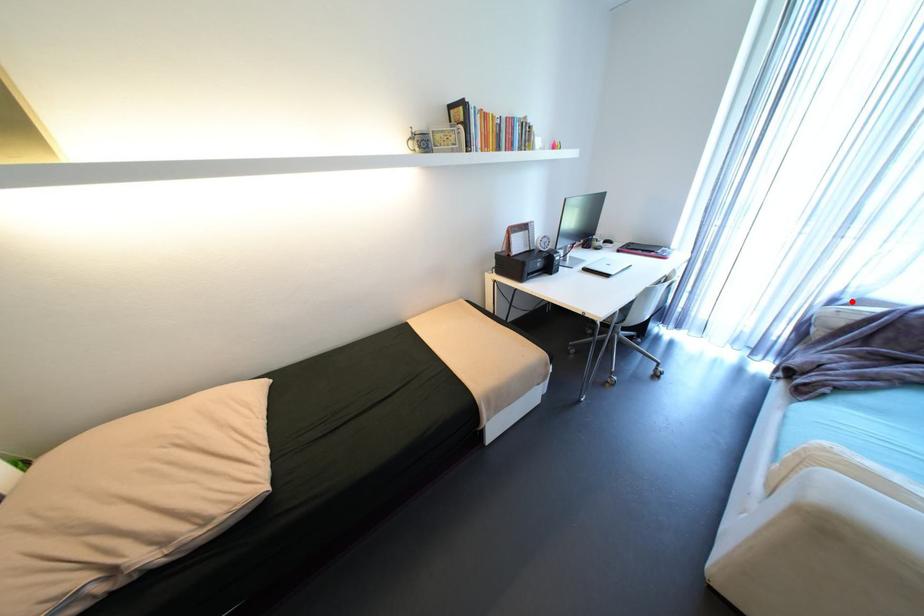
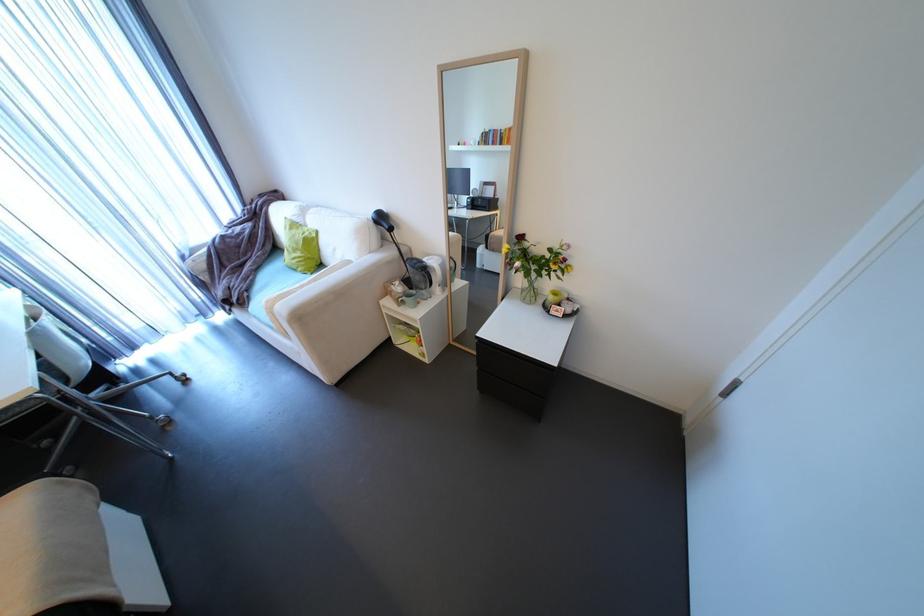
Question: I am providing you with two images of the same scene from different viewpoints. Image1 has a red point marked. In image2, the corresponding 3D location appears at what relative position? Reply with the corresponding letter.

Choices:
 (A) Closer
 (B) Farther

Answer: (A)